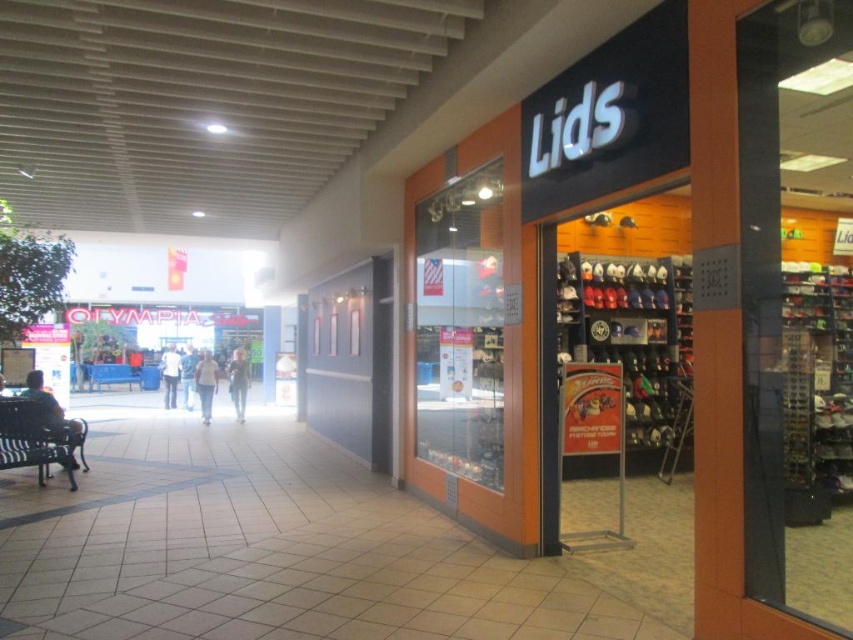
You are a person who wants to sit down in the shopping mall. You see a black metal bench at left and a blue fabric park bench at left. How far apart are the two benches?

The distance between the black metal bench at left and the blue fabric park bench at left is 16.09 meters.

You are a person who is 1.7 meters tall. You want to sit on either the black metal bench at left or the blue fabric park bench at left. Which bench would you find more comfortable in terms of height?

The black metal bench at left has a greater height compared to the blue fabric park bench at left. Since you are 1.7 meters tall, the black metal bench at left might be more comfortable as it is higher and closer to your seated height.